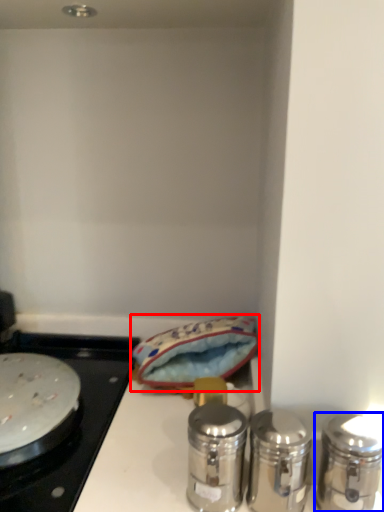
Question: Among these objects, which one is farthest to the camera, material (highlighted by a red box) or salt and pepper shakers (highlighted by a blue box)?

Choices:
 (A) material
 (B) salt and pepper shakers

Answer: (A)